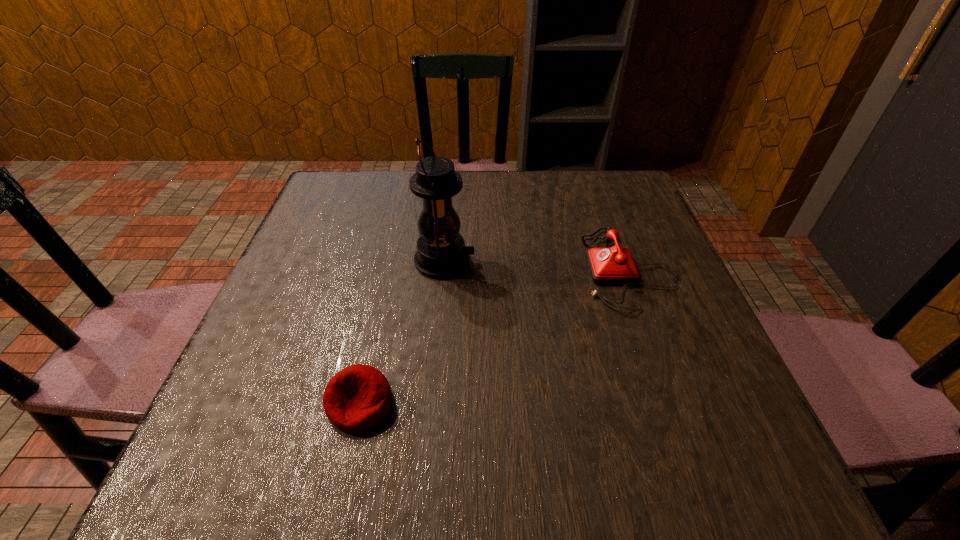
Find the location of a particular element. Image resolution: width=960 pixels, height=540 pixels. free spot between the lantern and the telephone is located at coordinates (536, 265).

The height and width of the screenshot is (540, 960). What are the coordinates of `free spot between the shortest object and the rightmost object` in the screenshot? It's located at (494, 336).

Locate an element on the screen. The height and width of the screenshot is (540, 960). free point between the lantern and the nearest object is located at coordinates (402, 332).

In order to click on vacant area between the second shortest object and the tallest object in this screenshot , I will do click(x=536, y=265).

Where is `free space between the tallest object and the second shortest object`? The width and height of the screenshot is (960, 540). free space between the tallest object and the second shortest object is located at coordinates (536, 265).

At what (x,y) coordinates should I click in order to perform the action: click on vacant point located between the telephone and the lantern. Please return your answer as a coordinate pair (x, y). Looking at the image, I should click on (536, 265).

Where is `vacant space that's between the second tallest object and the nearest object`? vacant space that's between the second tallest object and the nearest object is located at coordinates (494, 336).

Identify which object is the second closest to the tallest object. Please provide its 2D coordinates. Your answer should be formatted as a tuple, i.e. [(x, y)], where the tuple contains the x and y coordinates of a point satisfying the conditions above.

[(357, 398)]

Identify which object is located as the nearest to the telephone. Please provide its 2D coordinates. Your answer should be formatted as a tuple, i.e. [(x, y)], where the tuple contains the x and y coordinates of a point satisfying the conditions above.

[(441, 253)]

Where is `free space in the image that satisfies the following two spatial constraints: 1. above the lantern, indicating its light source; 2. on the seat area of the shortest object`? The image size is (960, 540). free space in the image that satisfies the following two spatial constraints: 1. above the lantern, indicating its light source; 2. on the seat area of the shortest object is located at coordinates (432, 403).